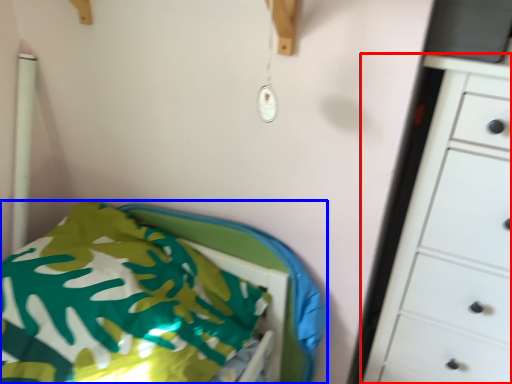
Question: Which object appears farthest to the camera in this image, chest of drawers (highlighted by a red box) or furniture (highlighted by a blue box)?

Choices:
 (A) chest of drawers
 (B) furniture

Answer: (B)